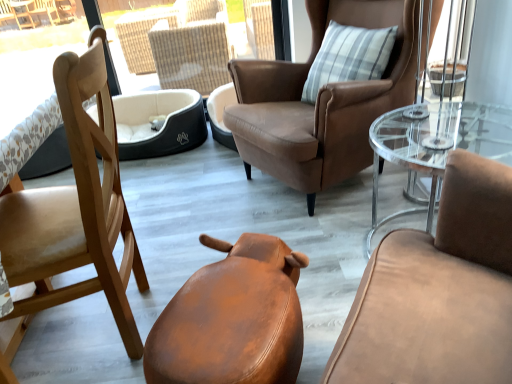
Question: Is light brown wood chair at left, which appears as the 1th chair when viewed from the left, bigger or smaller than leather-like brown stool at lower center, the second chair from the right?

Choices:
 (A) big
 (B) small

Answer: (A)

Question: From the image's perspective, relative to leather-like brown stool at lower center, which appears as the 2th chair when viewed from the left, is light brown wood chair at left, which appears as the 1th chair when viewed from the left, above or below?

Choices:
 (A) above
 (B) below

Answer: (A)

Question: Estimate the real-world distances between objects in this image. Which object is closer to the leather-like brown stool at lower center, which appears as the 2th chair when viewed from the left?

Choices:
 (A) black fabric dog bed at center
 (B) clear glass coffee table at right
 (C) brown leather chair at upper center, acting as the first chair starting from the right
 (D) light brown wood chair at left, which appears as the 1th chair when viewed from the left

Answer: (D)

Question: Which of these objects is positioned farthest from the black fabric dog bed at center?

Choices:
 (A) leather-like brown stool at lower center, the second chair from the right
 (B) light brown wood chair at left, which appears as the 1th chair when viewed from the left
 (C) clear glass coffee table at right
 (D) brown leather chair at upper center, which ranks as the 3th chair in left-to-right order

Answer: (A)